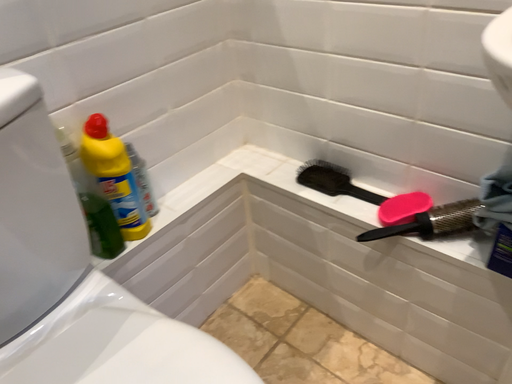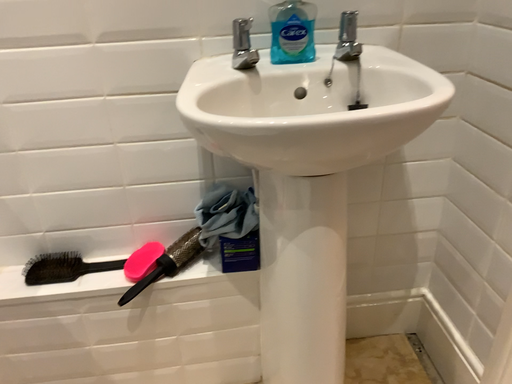
Question: How did the camera likely rotate when shooting the video?

Choices:
 (A) rotated downward
 (B) rotated upward

Answer: (B)